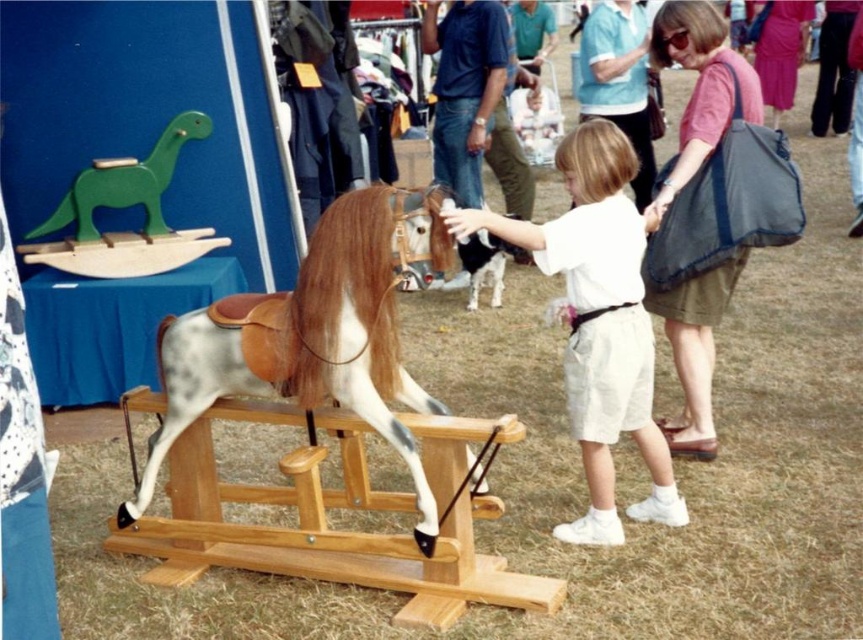
Question: Which of the following is the farthest from the observer?

Choices:
 (A) green wooden dinosaur at upper left
 (B) speckled wood horse at center

Answer: (A)

Question: Can you confirm if speckled wood horse at center is thinner than white cotton shirt at center?

Choices:
 (A) no
 (B) yes

Answer: (A)

Question: Which point is farther to the camera?

Choices:
 (A) (641, 228)
 (B) (165, 182)
 (C) (364, 324)

Answer: (B)

Question: Which is nearer to the green wooden dinosaur at upper left?

Choices:
 (A) speckled wood horse at center
 (B) white cotton shirt at center

Answer: (A)

Question: Can you confirm if white cotton shirt at center is positioned above green wooden dinosaur at upper left?

Choices:
 (A) yes
 (B) no

Answer: (B)

Question: Can you confirm if white cotton shirt at center is positioned to the right of green wooden dinosaur at upper left?

Choices:
 (A) no
 (B) yes

Answer: (B)